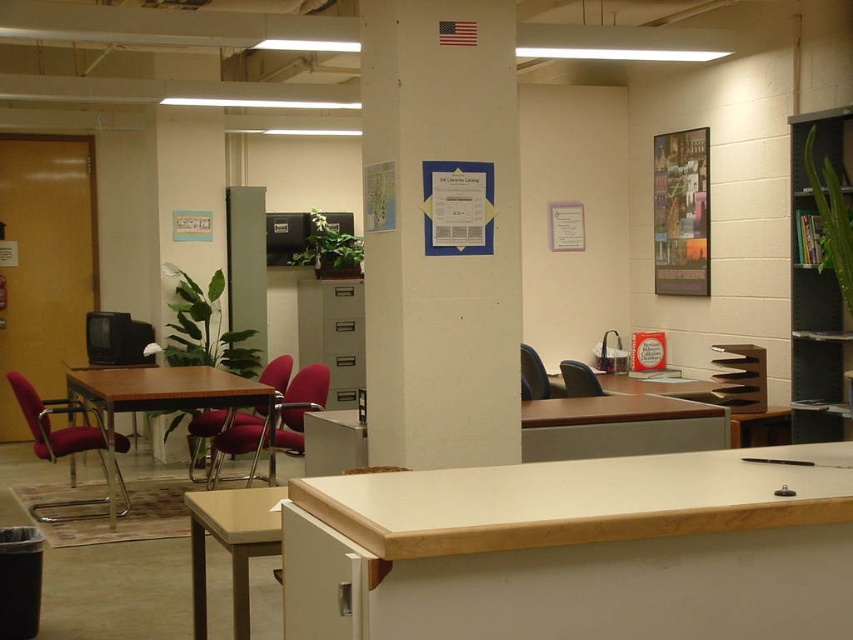
Between point (57, 444) and point (582, 380), which one is positioned behind?

The point (582, 380) is more distant.

Can you confirm if metallic red swivel chair at left is positioned to the left of matte plastic chair at center?

Yes, metallic red swivel chair at left is to the left of matte plastic chair at center.

Is point (22, 406) positioned behind point (567, 387)?

No, it is in front of (567, 387).

Locate an element on the screen. This screenshot has width=853, height=640. metallic red swivel chair at left is located at coordinates (59, 428).

This screenshot has width=853, height=640. Find the location of `light brown laminate table at lower center`. light brown laminate table at lower center is located at coordinates (231, 545).

Locate an element on the screen. This screenshot has height=640, width=853. light brown laminate table at lower center is located at coordinates (231, 545).

Identify the location of light brown laminate table at lower center. [x=231, y=545].

Which is below, light brown laminate table at lower center or matte plastic chair at center?

light brown laminate table at lower center is lower down.

Does point (258, 512) lie behind point (576, 374)?

No.

What do you see at coordinates (231, 545) in the screenshot? Image resolution: width=853 pixels, height=640 pixels. I see `light brown laminate table at lower center` at bounding box center [231, 545].

You are a GUI agent. You are given a task and a screenshot of the screen. Output one action in this format:
    pyautogui.click(x=<x>, y=<y>)
    Task: Click on the light brown laminate table at lower center
    Image resolution: width=853 pixels, height=640 pixels.
    Given the screenshot: What is the action you would take?
    pyautogui.click(x=231, y=545)